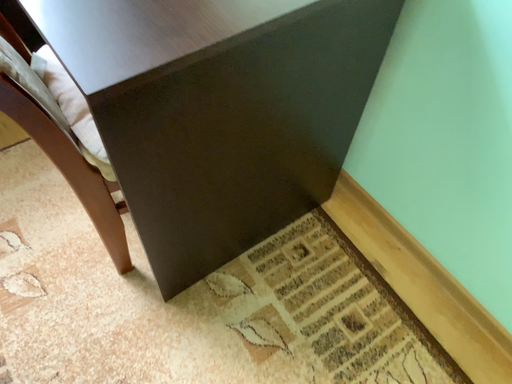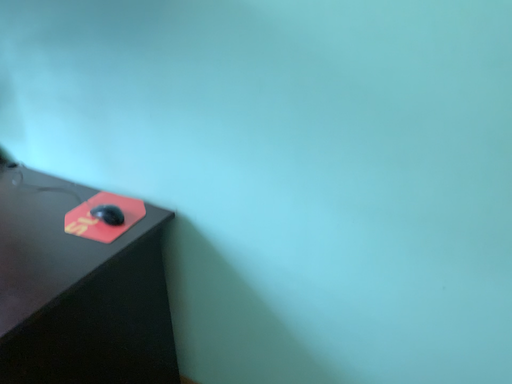
Question: Which way did the camera rotate in the video?

Choices:
 (A) rotated right
 (B) rotated left

Answer: (A)